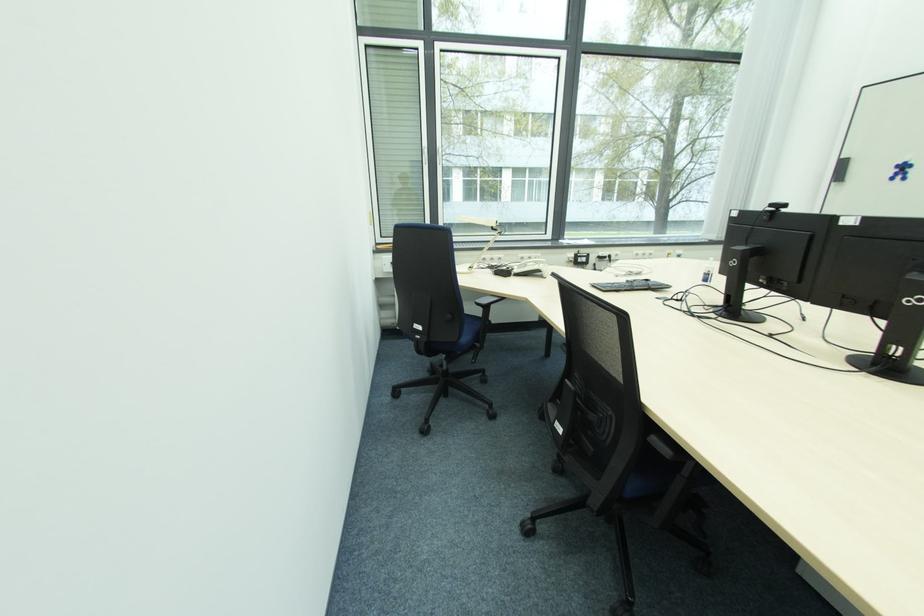
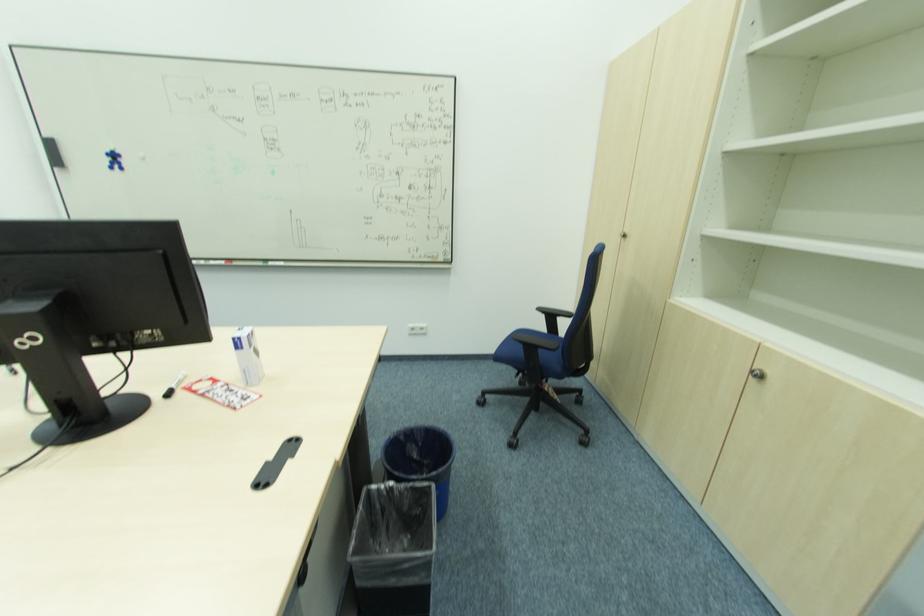
In the second image, find the point that corresponds to point 846,160 in the first image.

(52, 140)